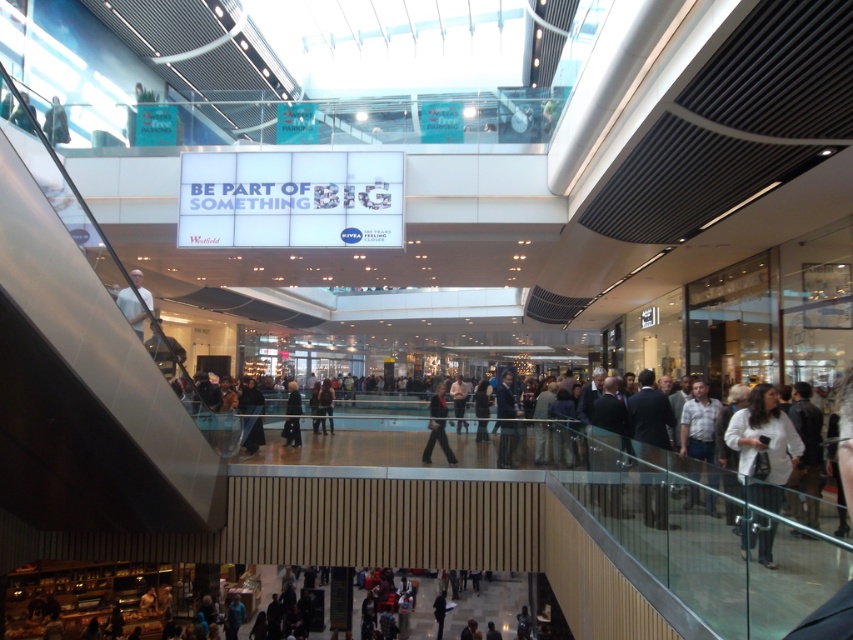
You are a customer in the mall and want to try on the white matte jacket at lower right and the dark gray suit at center. Which item should you pick up first to try on if you are standing at the entrance near the mall entrance?

You should pick up the white matte jacket at lower right first because it is closer to you than the dark gray suit at center.